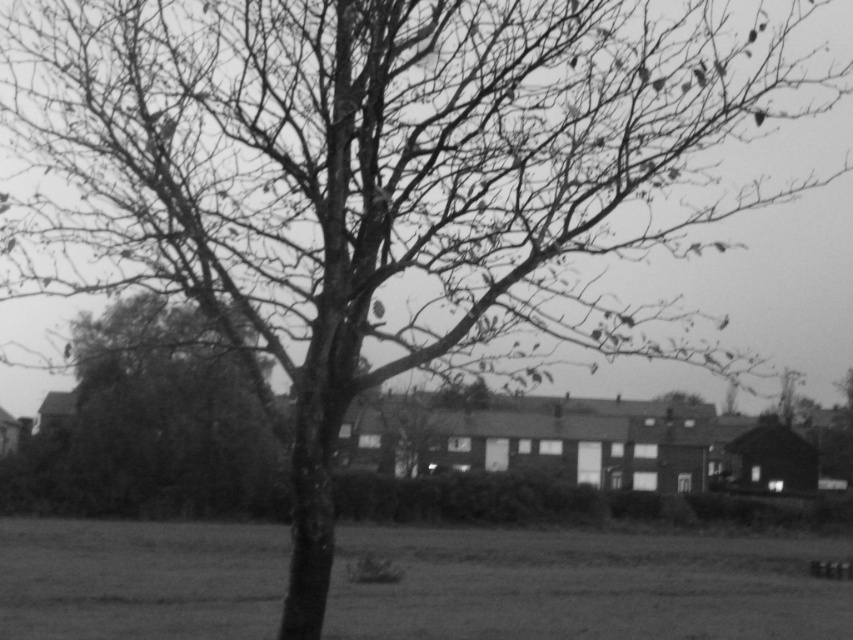
Can you confirm if grassy plain at lower center is wider than smooth bark tree at center?

Correct, the width of grassy plain at lower center exceeds that of smooth bark tree at center.

Who is more forward, (131, 604) or (251, 420)?

Point (131, 604)

The height and width of the screenshot is (640, 853). What are the coordinates of `grassy plain at lower center` in the screenshot? It's located at (585, 586).